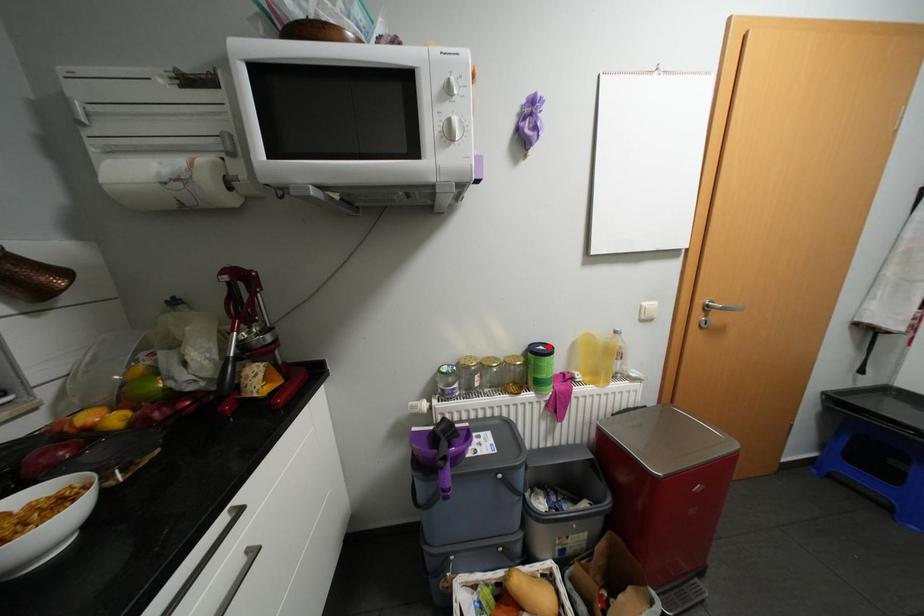
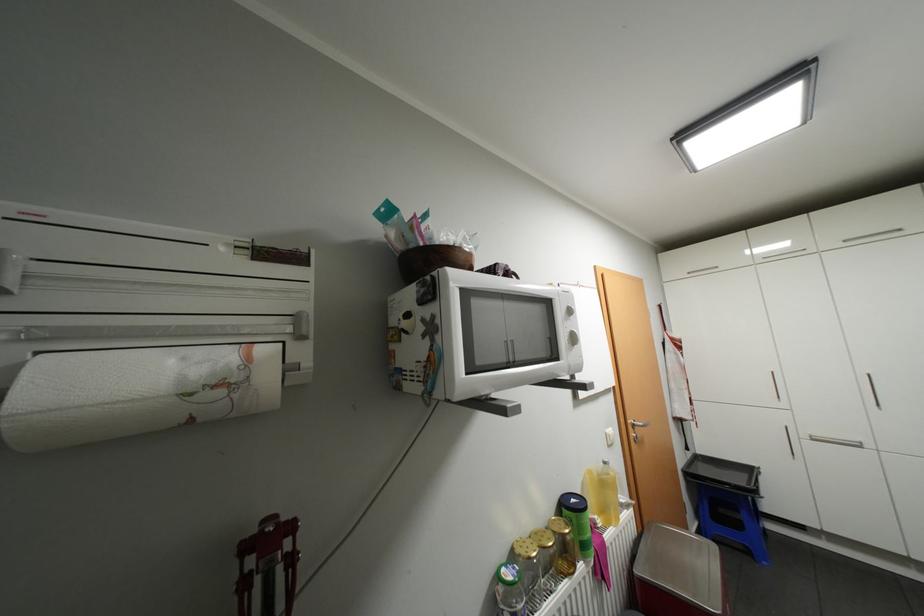
Find the pixel in the second image that matches the highlighted location in the first image.

(580, 499)